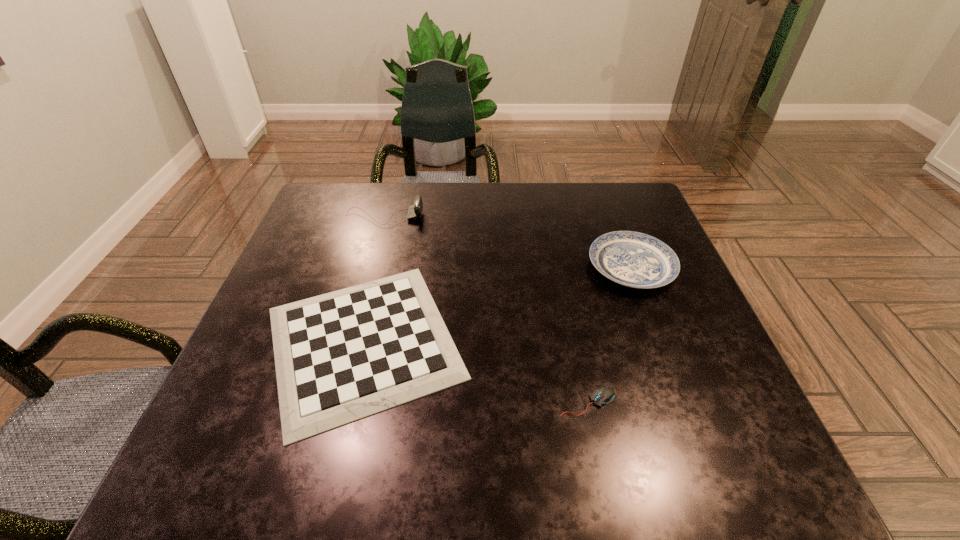
Locate an element on the screen. The image size is (960, 540). vacant space at the far left corner is located at coordinates (374, 190).

This screenshot has width=960, height=540. I want to click on vacant space at the far right corner of the desktop, so click(626, 219).

I want to click on free space at the near right corner of the desktop, so click(751, 448).

Identify the location of unoccupied position between the farthest object and the chessboard. (373, 280).

At what (x,y) coordinates should I click in order to perform the action: click on vacant point located between the tallest object and the rightmost object. Please return your answer as a coordinate pair (x, y). Looking at the image, I should click on (508, 242).

Where is `vacant area between the third shortest object and the chessboard`? vacant area between the third shortest object and the chessboard is located at coordinates (497, 305).

Identify the location of vacant region between the tallest object and the rightmost object. (508, 242).

This screenshot has height=540, width=960. Find the location of `free space between the chessboard and the third object from left to right`. free space between the chessboard and the third object from left to right is located at coordinates (475, 372).

This screenshot has height=540, width=960. In order to click on unoccupied area between the mouse and the chessboard in this screenshot , I will do `click(475, 372)`.

This screenshot has width=960, height=540. In order to click on blank region between the plate and the third object from left to right in this screenshot , I will do `click(610, 334)`.